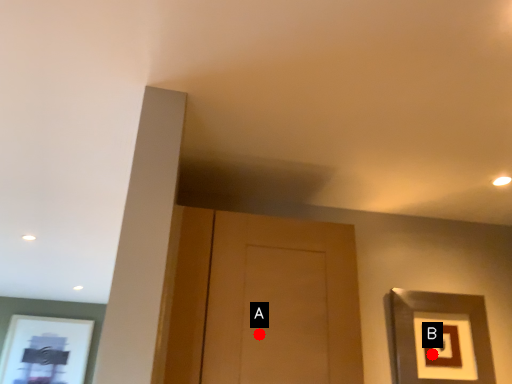
Question: Two points are circled on the image, labeled by A and B beside each circle. Among these points, which one is nearest to the camera?

Choices:
 (A) A is closer
 (B) B is closer

Answer: (A)